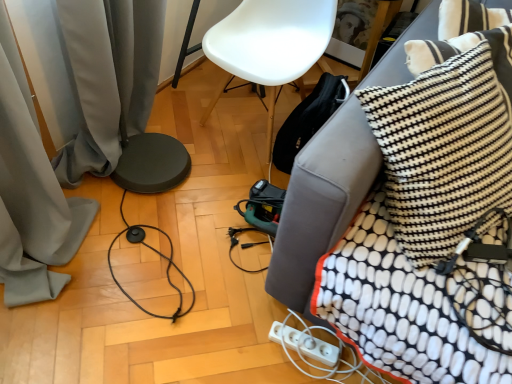
Identify the location of vacant location below gray fabric curtain at lower left (from a real-world perspective). (169, 189).